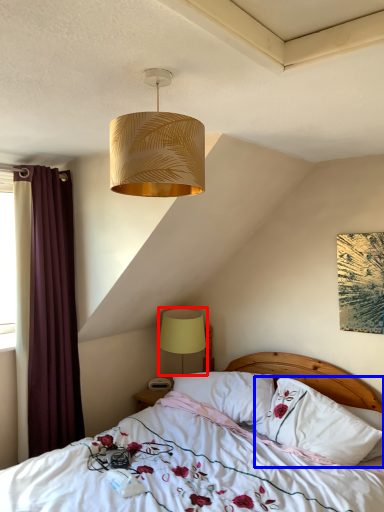
Question: Which of the following is the closest to the observer, lamp (highlighted by a red box) or pillow (highlighted by a blue box)?

Choices:
 (A) lamp
 (B) pillow

Answer: (B)